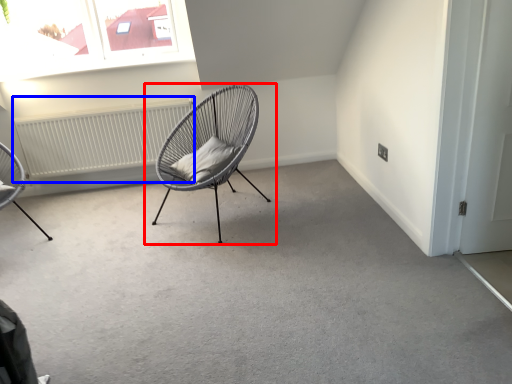
Question: Which of the following is the closest to the observer, chair (highlighted by a red box) or radiator (highlighted by a blue box)?

Choices:
 (A) chair
 (B) radiator

Answer: (A)